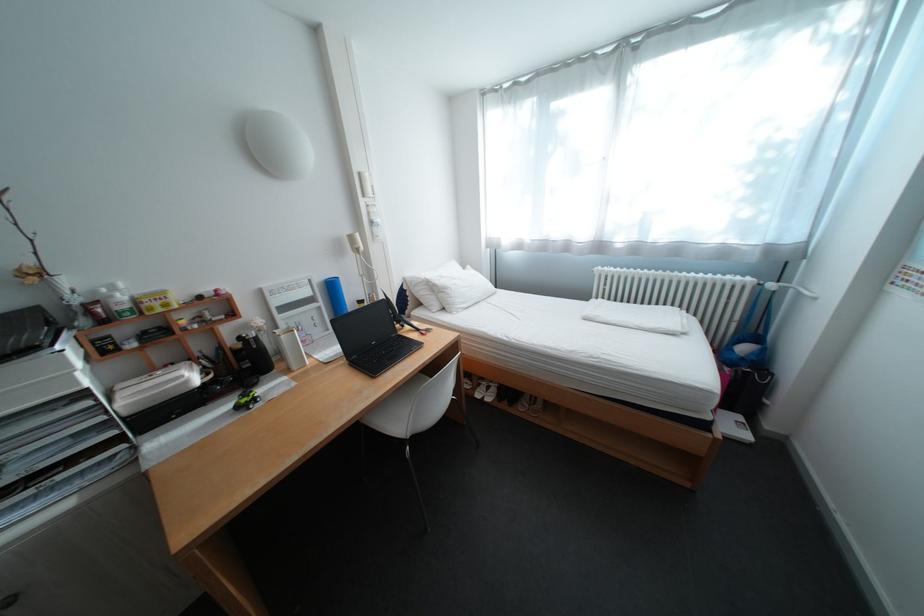
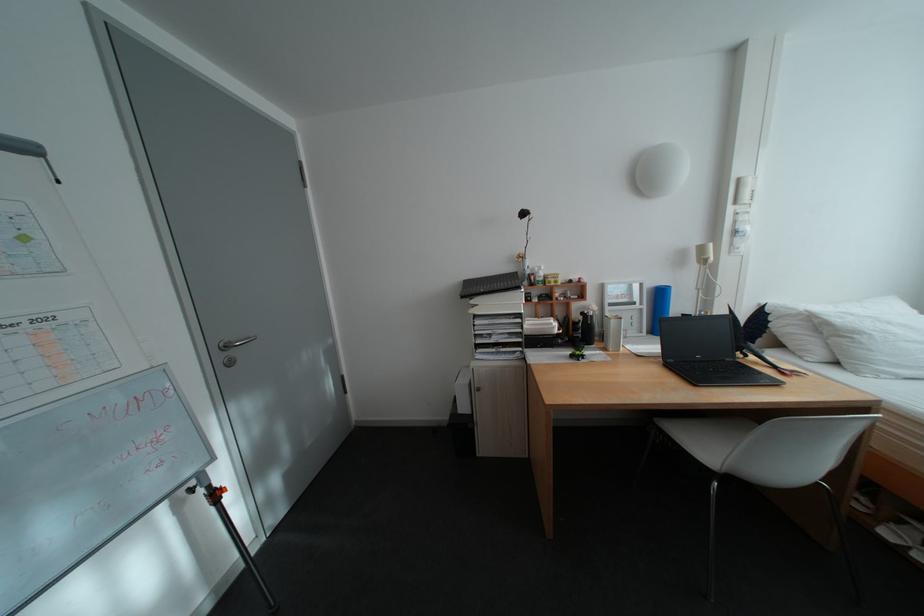
Locate, in the second image, the point that corresponds to point (334, 304) in the first image.

(657, 307)